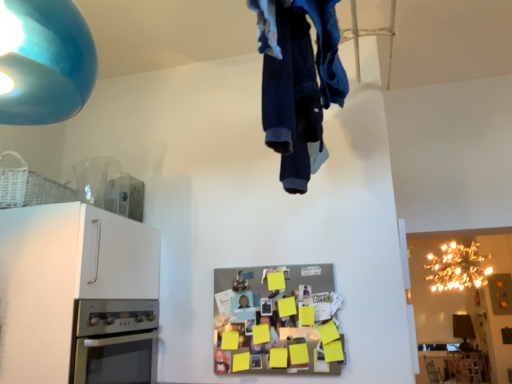
Question: Is matte blue lampshade at upper left, the first lamp viewed from the left, touching denim fabric pants at upper center?

Choices:
 (A) yes
 (B) no

Answer: (B)

Question: Is matte blue lampshade at upper left, which is counted as the first lamp, starting from the front, smaller than denim fabric pants at upper center?

Choices:
 (A) yes
 (B) no

Answer: (B)

Question: Does matte blue lampshade at upper left, the first lamp in the top-to-bottom sequence, lie behind denim fabric pants at upper center?

Choices:
 (A) no
 (B) yes

Answer: (A)

Question: Is matte blue lampshade at upper left, the second lamp from the bottom, outside denim fabric pants at upper center?

Choices:
 (A) yes
 (B) no

Answer: (A)

Question: From the image's perspective, is matte blue lampshade at upper left, the second lamp from the bottom, above denim fabric pants at upper center?

Choices:
 (A) no
 (B) yes

Answer: (B)

Question: Based on their positions, is gold metallic chandelier at upper right, the second lamp when ordered from left to right, located to the left or right of white matte cabinet at left?

Choices:
 (A) right
 (B) left

Answer: (A)

Question: Does point (483, 281) appear closer or farther from the camera than point (113, 216)?

Choices:
 (A) closer
 (B) farther

Answer: (B)

Question: Is gold metallic chandelier at upper right, which ranks as the 1th lamp in back-to-front order, situated inside white matte cabinet at left or outside?

Choices:
 (A) outside
 (B) inside

Answer: (A)

Question: Is gold metallic chandelier at upper right, the second lamp when ordered from left to right, in front of or behind white matte cabinet at left in the image?

Choices:
 (A) front
 (B) behind

Answer: (B)

Question: Looking at their shapes, would you say stainless steel oven at lower left is wider or thinner than matte blue lampshade at upper left, the second lamp from the bottom?

Choices:
 (A) wide
 (B) thin

Answer: (A)

Question: From a real-world perspective, is stainless steel oven at lower left above or below matte blue lampshade at upper left, the first lamp in the top-to-bottom sequence?

Choices:
 (A) above
 (B) below

Answer: (B)

Question: Is stainless steel oven at lower left in front of or behind matte blue lampshade at upper left, acting as the second lamp starting from the right, in the image?

Choices:
 (A) front
 (B) behind

Answer: (B)

Question: Considering the relative positions of stainless steel oven at lower left and matte blue lampshade at upper left, acting as the second lamp starting from the right, in the image provided, is stainless steel oven at lower left to the left or to the right of matte blue lampshade at upper left, acting as the second lamp starting from the right,?

Choices:
 (A) left
 (B) right

Answer: (A)

Question: Is white matte cabinet at left to the left or to the right of metallic silver refrigerator at center in the image?

Choices:
 (A) left
 (B) right

Answer: (A)

Question: From the image's perspective, is white matte cabinet at left positioned above or below metallic silver refrigerator at center?

Choices:
 (A) above
 (B) below

Answer: (A)